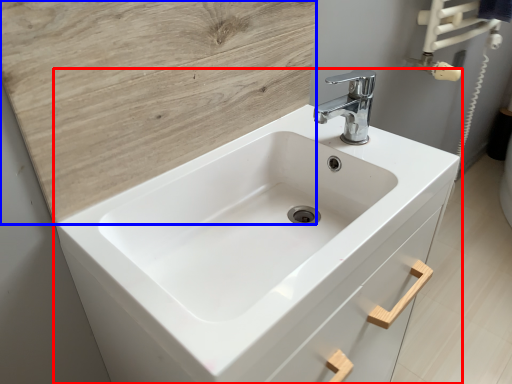
Question: Among these objects, which one is nearest to the camera, sink (highlighted by a red box) or plywood (highlighted by a blue box)?

Choices:
 (A) sink
 (B) plywood

Answer: (A)